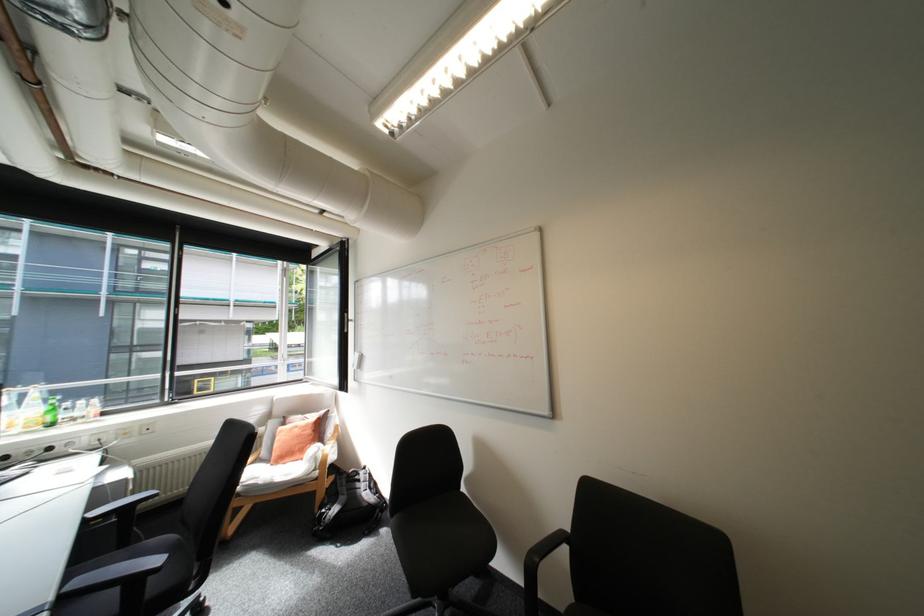
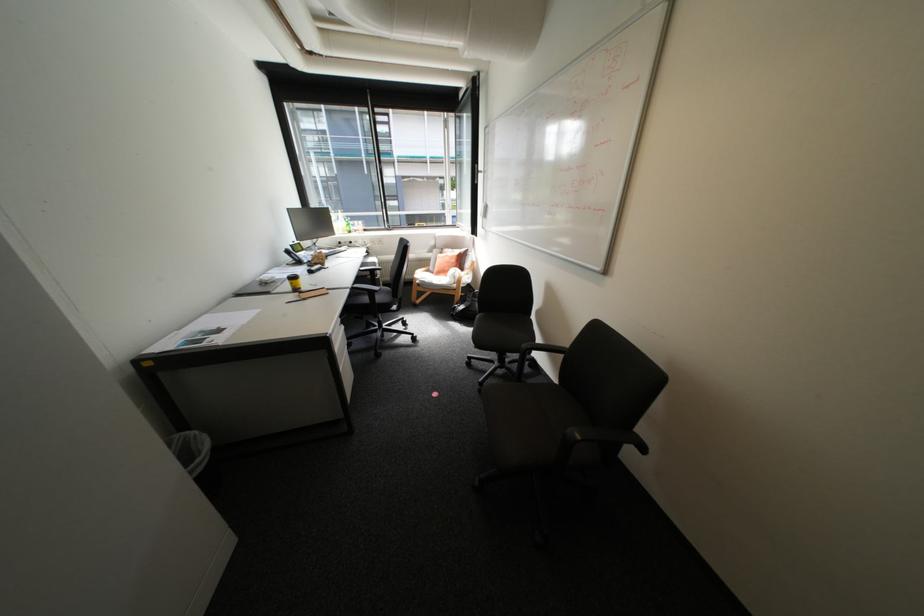
Find the pixel in the second image that matches (x=548, y=560) in the first image.

(539, 347)